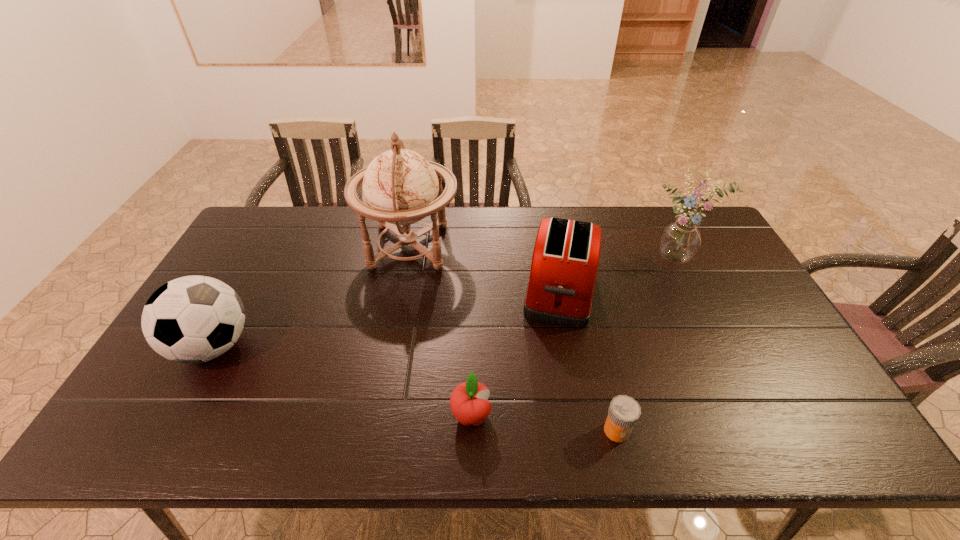
Locate an element on the screen. The height and width of the screenshot is (540, 960). vacant region located 0.390m on the front-facing side of the rightmost object is located at coordinates (739, 376).

Image resolution: width=960 pixels, height=540 pixels. What are the coordinates of `vacant point located on the right of the toaster` in the screenshot? It's located at (660, 292).

Identify the location of vacant space located on the main logo of the soccer ball. The width and height of the screenshot is (960, 540). (325, 346).

Where is `vacant region located 0.170m on the left of the third object from left to right`? vacant region located 0.170m on the left of the third object from left to right is located at coordinates (378, 416).

This screenshot has height=540, width=960. Identify the location of globe located at the far edge. (401, 187).

You are a GUI agent. You are given a task and a screenshot of the screen. Output one action in this format:
    pyautogui.click(x=<x>, y=<y>)
    Task: Click on the bouquet located in the far edge section of the desktop
    
    Given the screenshot: What is the action you would take?
    [x=680, y=240]

This screenshot has height=540, width=960. I want to click on apple that is positioned at the near edge, so click(468, 402).

Locate an element on the screen. Image resolution: width=960 pixels, height=540 pixels. medicine that is at the near edge is located at coordinates (624, 411).

I want to click on object that is at the left edge, so click(x=193, y=319).

At what (x,y) coordinates should I click in order to perform the action: click on object that is at the right edge. Please return your answer as a coordinate pair (x, y). The image size is (960, 540). Looking at the image, I should click on (680, 240).